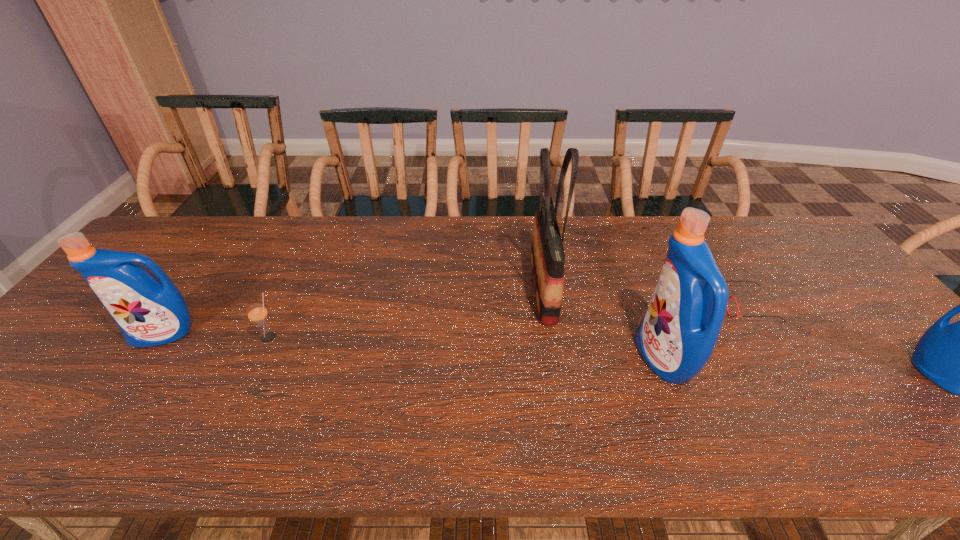
The height and width of the screenshot is (540, 960). I want to click on object at the far edge, so click(x=547, y=253).

Where is `object present at the near edge`? This screenshot has height=540, width=960. object present at the near edge is located at coordinates (678, 333).

The image size is (960, 540). What are the coordinates of `vacant region at the far edge of the desktop` in the screenshot? It's located at (316, 220).

Identify the location of blank area at the near edge. (432, 396).

You are a GUI agent. You are given a task and a screenshot of the screen. Output one action in this format:
    pyautogui.click(x=<x>, y=<y>)
    Task: Click on the vacant space at the right edge of the desktop
    The image size is (960, 540).
    Given the screenshot: What is the action you would take?
    pyautogui.click(x=828, y=265)

Find the location of a particular element. Image resolution: width=960 pixels, height=540 pixels. vacant space at the far left corner is located at coordinates (191, 232).

This screenshot has width=960, height=540. I want to click on unoccupied position between the leftmost detergent and the fifth object from left to right, so click(456, 320).

This screenshot has width=960, height=540. Find the location of `free space between the fourth object from right to left and the fifth object from right to left`. free space between the fourth object from right to left and the fifth object from right to left is located at coordinates (406, 312).

You are a GUI agent. You are given a task and a screenshot of the screen. Output one action in this format:
    pyautogui.click(x=<x>, y=<y>)
    Task: Click on the vacant area that lies between the third tallest object and the second object from right to left
    The height and width of the screenshot is (540, 960).
    Given the screenshot: What is the action you would take?
    pyautogui.click(x=456, y=320)

The image size is (960, 540). In order to click on empty space that is in between the straw and the second detergent from right to left in this screenshot , I will do `click(466, 348)`.